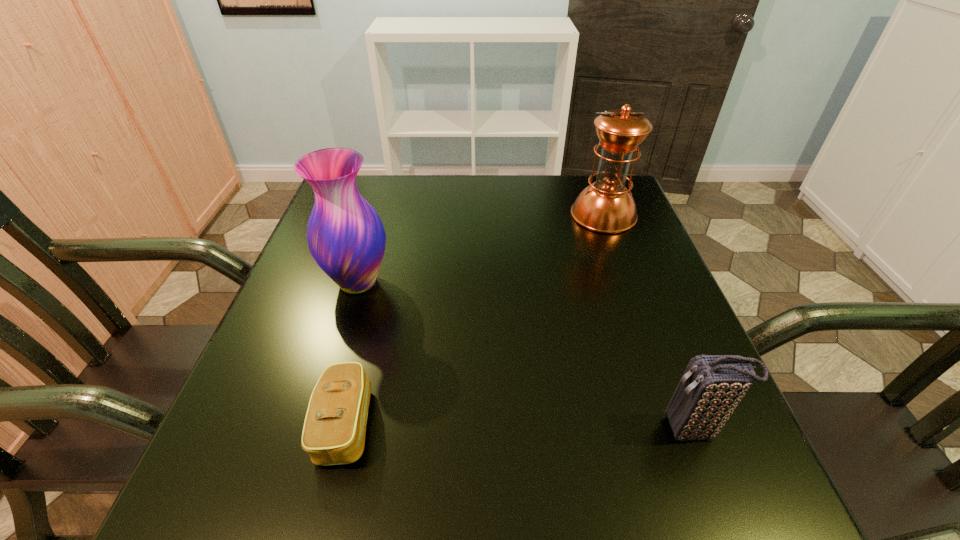
The width and height of the screenshot is (960, 540). In order to click on vacant space at the far edge of the desktop in this screenshot , I will do `click(464, 186)`.

Locate an element on the screen. vacant area at the near edge of the desktop is located at coordinates (440, 481).

The image size is (960, 540). I want to click on vacant space at the left edge of the desktop, so click(x=301, y=329).

Where is `vacant space at the right edge of the desktop`? The image size is (960, 540). vacant space at the right edge of the desktop is located at coordinates (639, 257).

Where is `free location at the near left corner`? This screenshot has height=540, width=960. free location at the near left corner is located at coordinates (270, 488).

I want to click on vacant space at the near right corner, so click(x=706, y=496).

Where is `empty location between the right clutch bag and the second farthest object`? empty location between the right clutch bag and the second farthest object is located at coordinates (526, 356).

Locate an element on the screen. Image resolution: width=960 pixels, height=540 pixels. free space between the oil lamp and the third nearest object is located at coordinates (481, 248).

The height and width of the screenshot is (540, 960). What are the coordinates of `vacant region between the oil lamp and the vase` in the screenshot? It's located at click(481, 248).

Locate an element on the screen. Image resolution: width=960 pixels, height=540 pixels. empty space between the third tallest object and the vase is located at coordinates (526, 356).